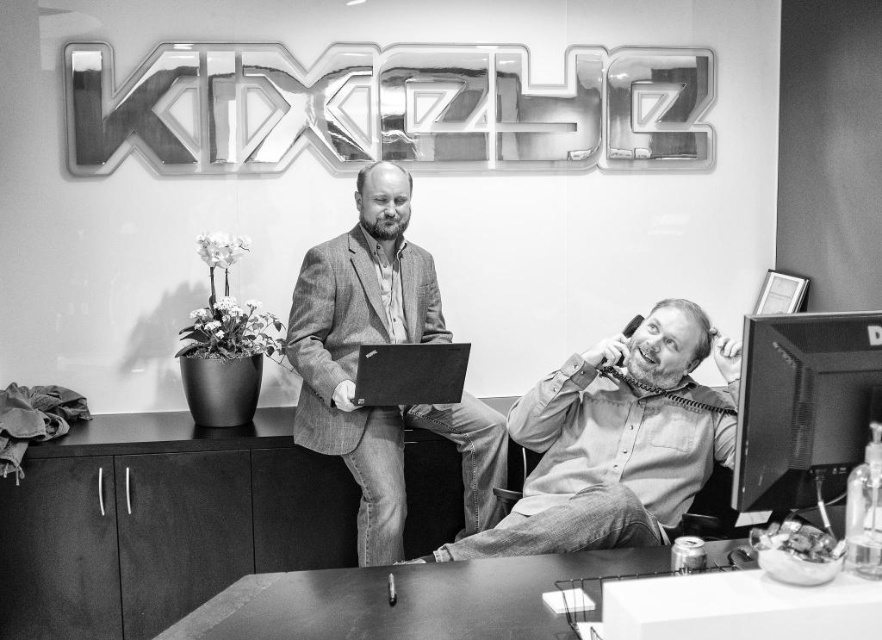
You are a photographer adjusting your camera settings to capture the scene. You notice the light gray shirt at center and the black matte laptop at center. Which object should you focus on first if you want to ensure both are in sharp focus, considering their positions?

The light gray shirt at center is below the black matte laptop at center, so focusing on the black matte laptop at center first will help ensure both are in sharp focus as it is closer to the camera.

You are a photographer adjusting the focus of your camera. You want to capture both the light gray shirt at center and the black matte laptop at center in sharp focus. Given that your camera has a depth of field that can cover 18 inches, will both objects be in focus?

The light gray shirt at center and black matte laptop at center are 18.76 inches apart. Since the camera can only cover 18 inches, the distance between them exceeds the depth of field capacity, so both objects cannot be in focus simultaneously.

Based on the photo, you are a photographer setting up for a photoshoot in the office scene. You need to position a light source so that it illuminates the black matte laptop at center without casting a shadow on the textured gray blazer at center. Is this possible given their current positions?

The black matte laptop at center is behind the textured gray blazer at center. Therefore, positioning a light source in front of the textured gray blazer at center would illuminate the laptop while preventing shadows from falling on the blazer.